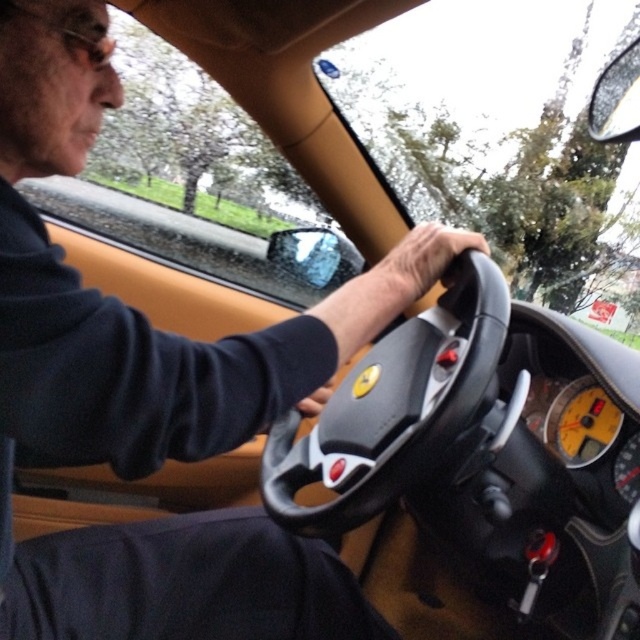
You are a passenger in the Ferrari and want to check the speedometer. Which object is closer to you, the transparent glass windshield at upper center or the leather at center?

The leather at center is behind the transparent glass windshield at upper center, so the transparent glass windshield at upper center is closer to you.

You are sitting in the passenger seat of the Ferrari and notice two points on the dashboard. The first point is at coordinates point (317, 211) and the second is at point (444, 236). Which point is closer to you?

Point (317, 211) is further to the camera than point (444, 236), so the point closer to you is point (444, 236).